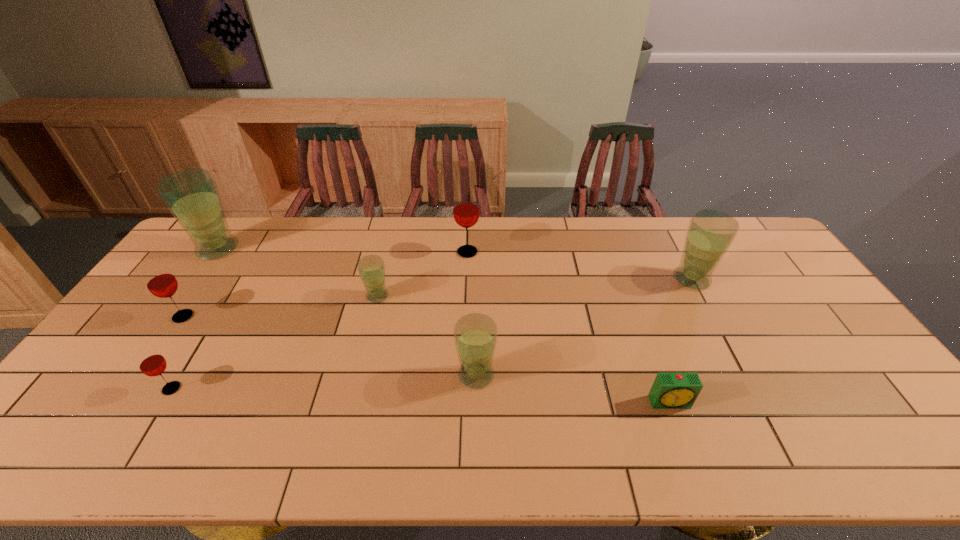
At what (x,y) coordinates should I click in order to perform the action: click on free point located on the left of the second blue glass from right to left. Please return your answer as a coordinate pair (x, y). This screenshot has height=540, width=960. Looking at the image, I should click on (379, 375).

Identify the location of vacant space positioned on the left of the smallest blue glass. pos(332,296).

Find the location of a particular element. This screenshot has height=540, width=960. free space located 0.070m on the front of the fifth glass from right to left is located at coordinates (151, 423).

Where is `free space located 0.090m on the front-facing side of the shortest object`? free space located 0.090m on the front-facing side of the shortest object is located at coordinates (685, 445).

Where is `object at the far left corner`? The height and width of the screenshot is (540, 960). object at the far left corner is located at coordinates (191, 195).

Where is `blank space at the far edge`? blank space at the far edge is located at coordinates (575, 250).

In order to click on vacant space at the near edge in this screenshot , I will do `click(526, 439)`.

Find the location of a particular element. Image resolution: width=960 pixels, height=540 pixels. vacant area at the left edge of the desktop is located at coordinates (175, 265).

At what (x,y) coordinates should I click in order to perform the action: click on free spot at the far right corner of the desktop. Please return your answer as a coordinate pair (x, y). Looking at the image, I should click on (755, 248).

The width and height of the screenshot is (960, 540). What are the coordinates of `free region at the near right corner of the desktop` in the screenshot? It's located at (849, 430).